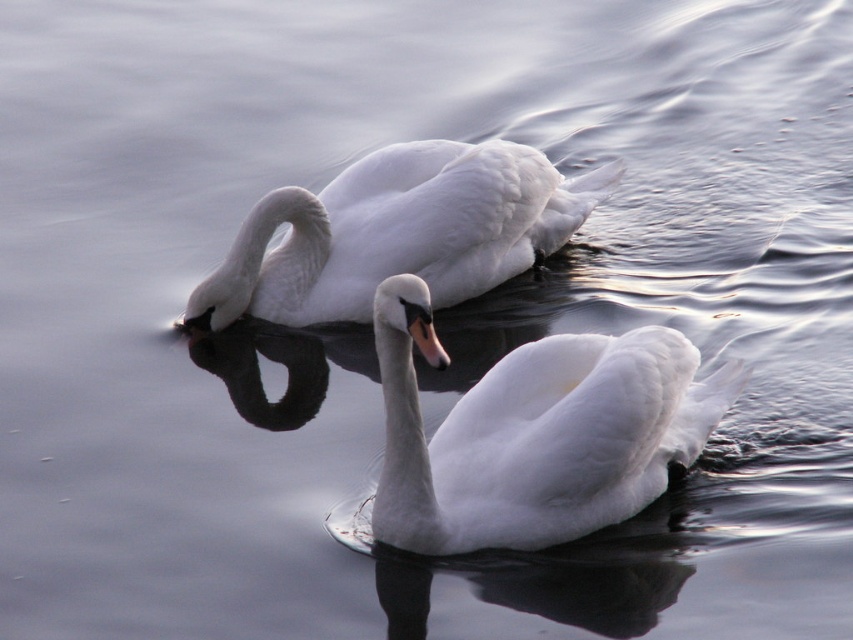
Question: Does white glossy swan at center come behind white glossy swan at upper center?

Choices:
 (A) no
 (B) yes

Answer: (A)

Question: Which point is farther to the camera?

Choices:
 (A) (561, 186)
 (B) (625, 486)

Answer: (A)

Question: Does white glossy swan at center have a smaller size compared to white glossy swan at upper center?

Choices:
 (A) yes
 (B) no

Answer: (B)

Question: Among these points, which one is nearest to the camera?

Choices:
 (A) (495, 385)
 (B) (338, 310)

Answer: (A)

Question: Can you confirm if white glossy swan at center is thinner than white glossy swan at upper center?

Choices:
 (A) no
 (B) yes

Answer: (B)